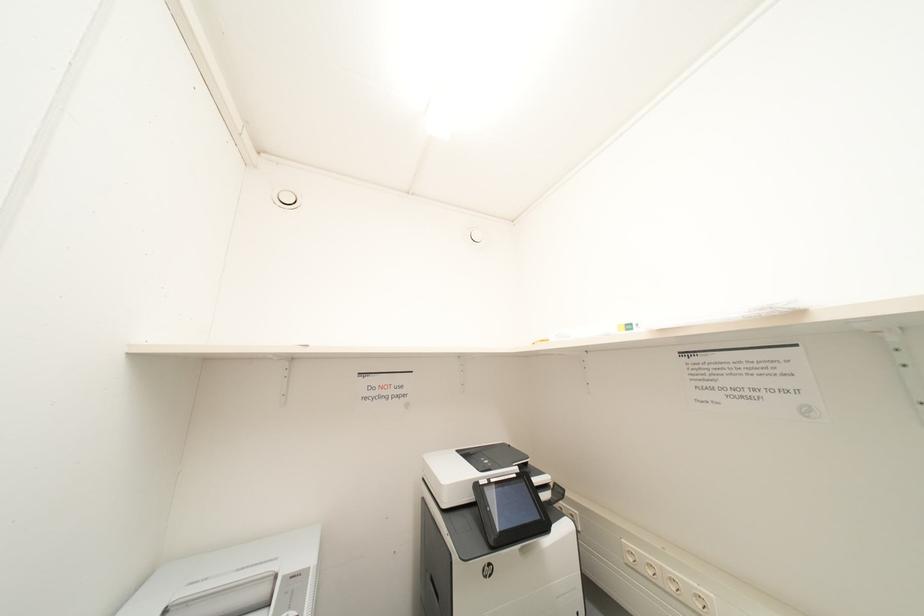
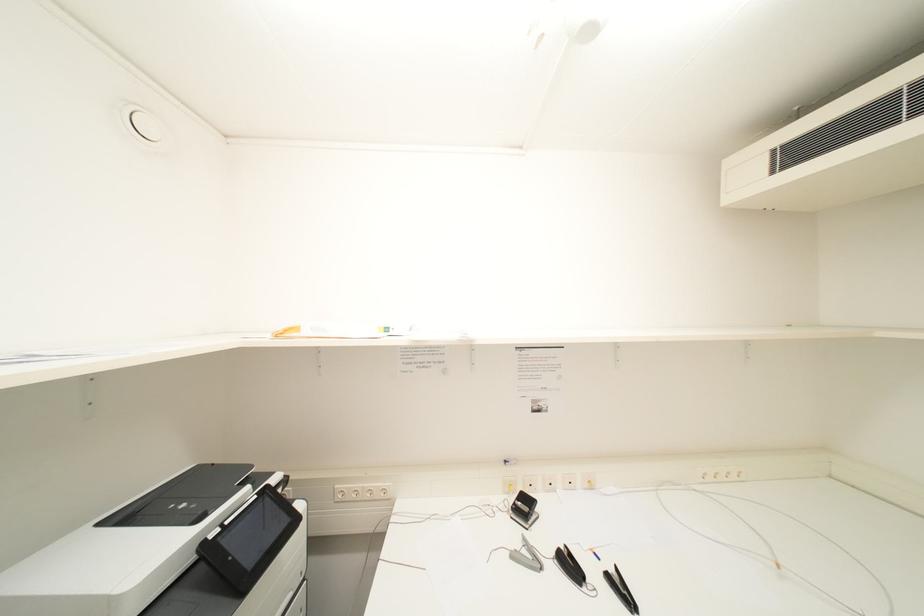
Question: The camera is either moving clockwise (left) or counter-clockwise (right) around the object. The first image is from the beginning of the video and the second image is from the end. Is the camera moving left or right when shooting the video?

Choices:
 (A) Left
 (B) Right

Answer: (A)